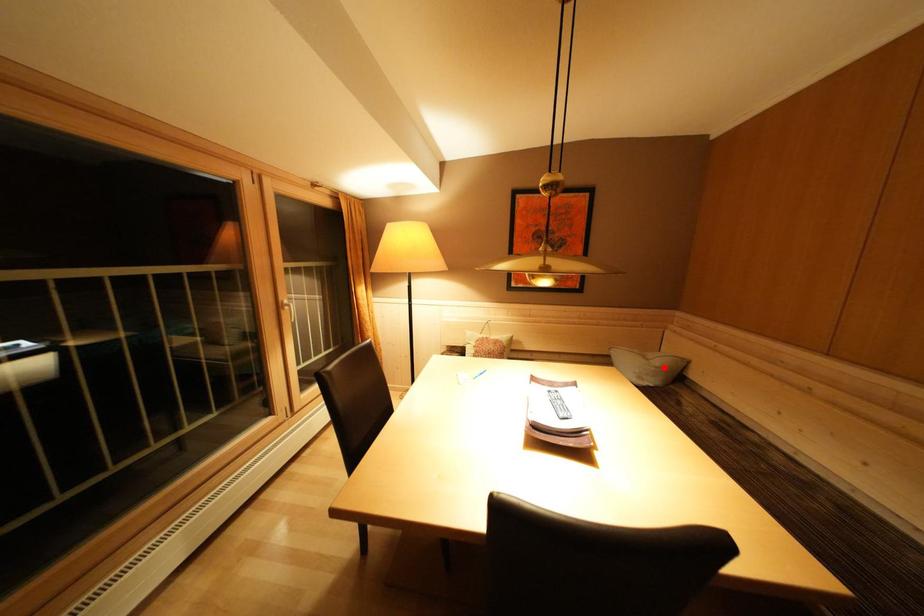
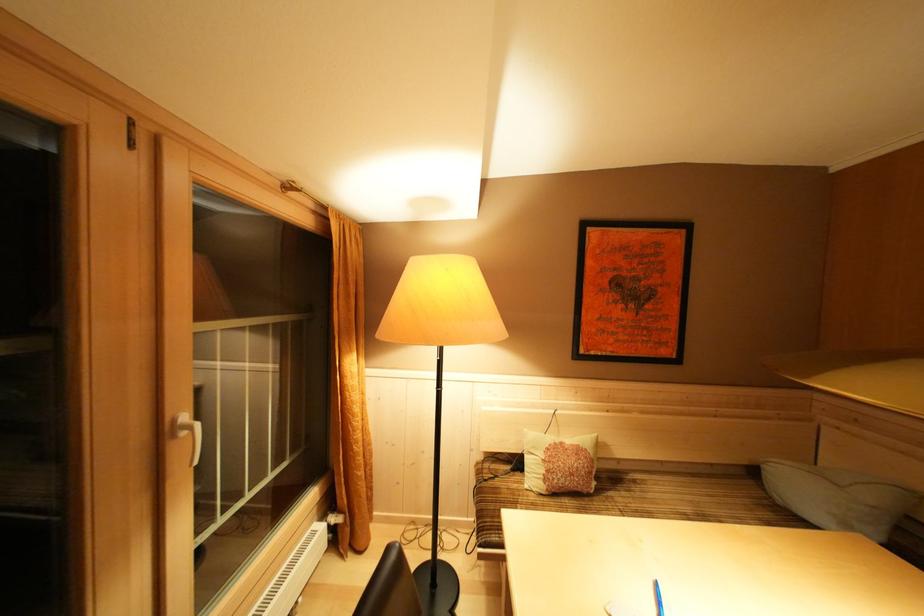
Where in the second image is the point corresponding to the highlighted location from the first image?

(879, 503)